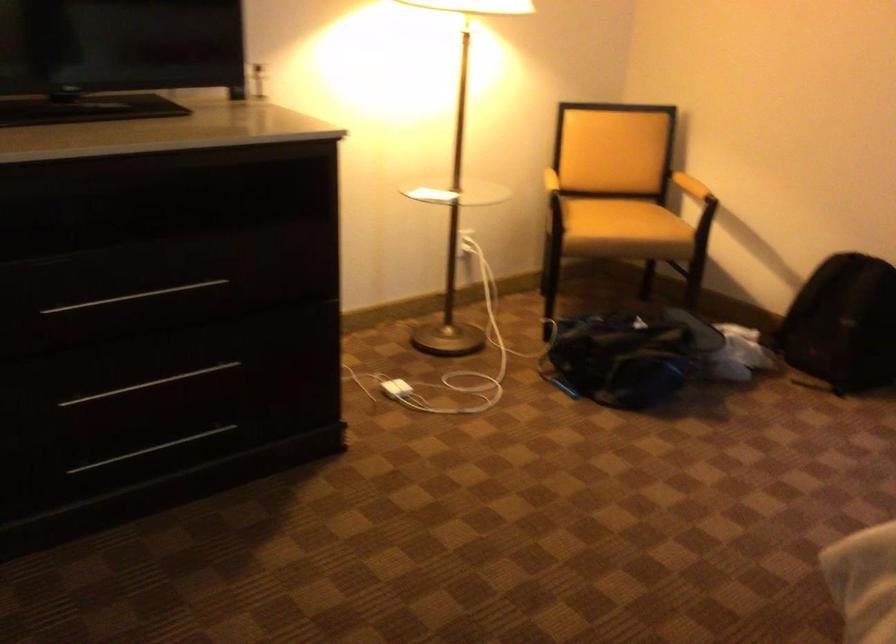
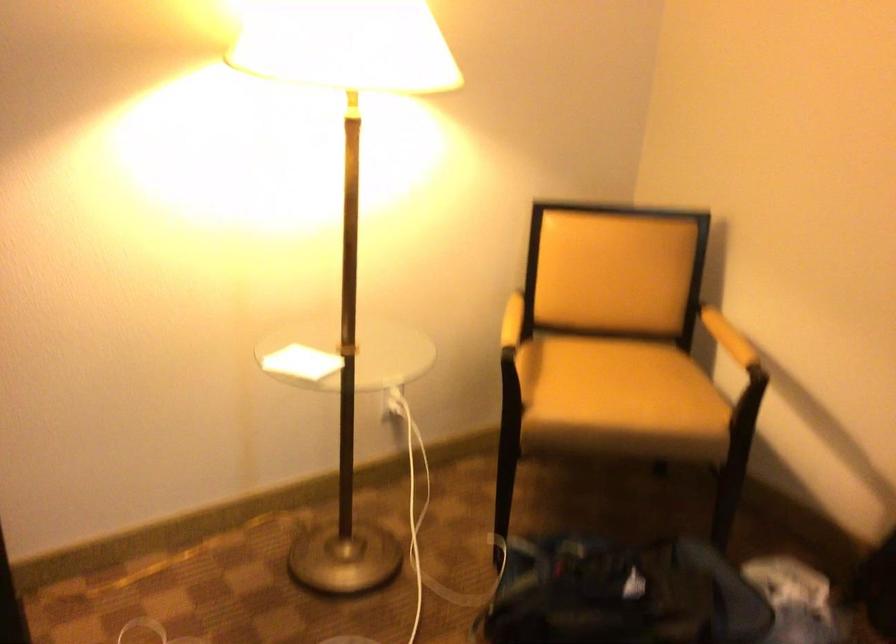
Find the pixel in the second image that matches (617,214) in the first image.

(618, 388)